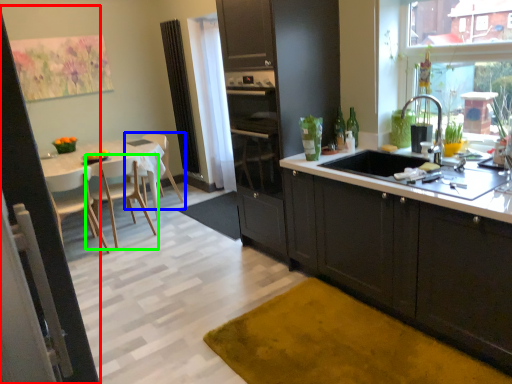
Question: Estimate the real-world distances between objects in this image. Which object is closer to screen door (highlighted by a red box), chair (highlighted by a blue box) or chair (highlighted by a green box)?

Choices:
 (A) chair
 (B) chair

Answer: (B)